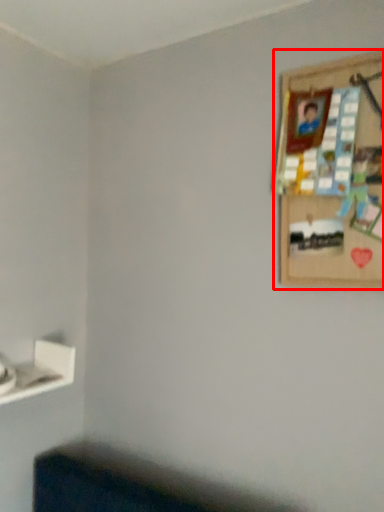
Question: From the image's perspective, where is picture frame (annotated by the red box) located relative to shelf?

Choices:
 (A) below
 (B) above

Answer: (B)